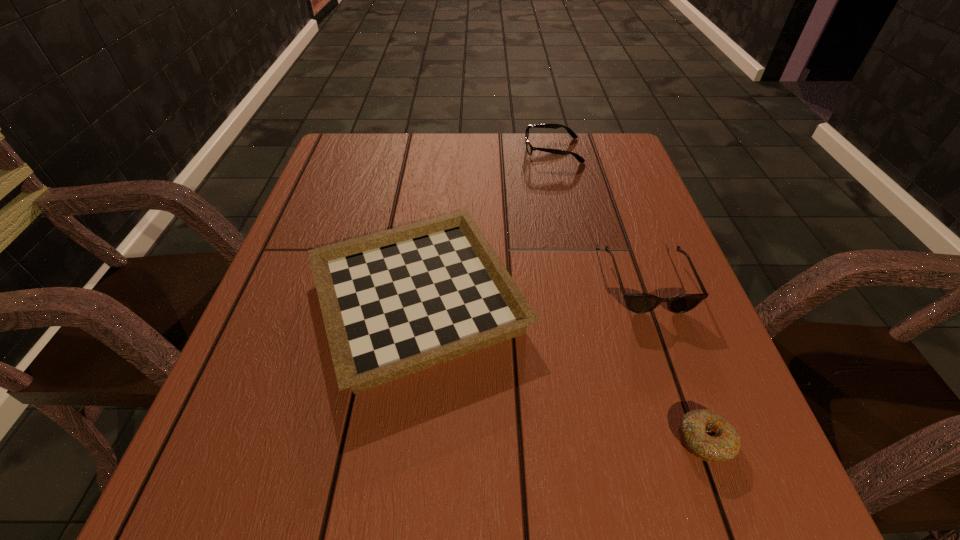
You are a GUI agent. You are given a task and a screenshot of the screen. Output one action in this format:
    pyautogui.click(x=<x>, y=<y>)
    Task: Click on the free space at the near edge of the desktop
    
    Given the screenshot: What is the action you would take?
    pyautogui.click(x=379, y=495)

The width and height of the screenshot is (960, 540). Identify the location of vacant area at the right edge of the desktop. (716, 363).

The height and width of the screenshot is (540, 960). In the image, there is a desktop. In order to click on vacant space at the far left corner in this screenshot , I will do `click(376, 136)`.

Identify the location of vacant space at the near left corner of the desktop. This screenshot has width=960, height=540. (205, 518).

I want to click on vacant space at the far right corner of the desktop, so click(585, 147).

Identify the location of vacant space that is in between the sunglasses and the farthest object. (600, 217).

At what (x,y) coordinates should I click in order to perform the action: click on vacant point located between the shortest object and the leftmost object. Please return your answer as a coordinate pair (x, y). This screenshot has height=540, width=960. Looking at the image, I should click on (562, 369).

Locate an element on the screen. unoccupied position between the checkerboard and the nearest object is located at coordinates (562, 369).

This screenshot has width=960, height=540. Identify the location of vacant area between the sunglasses and the nearest object. (677, 361).

The height and width of the screenshot is (540, 960). What are the coordinates of `unoccupied position between the nearest object and the checkerboard` in the screenshot? It's located at (562, 369).